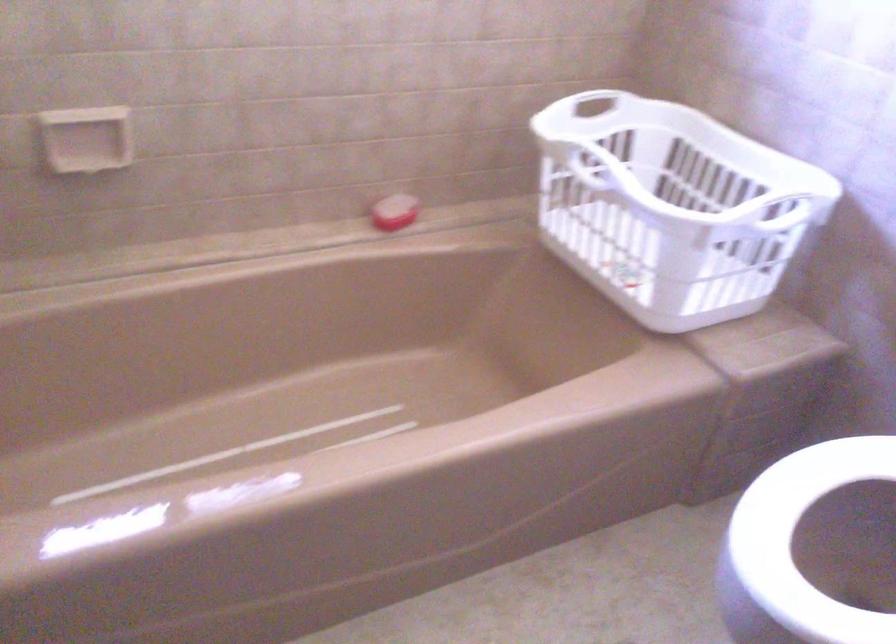
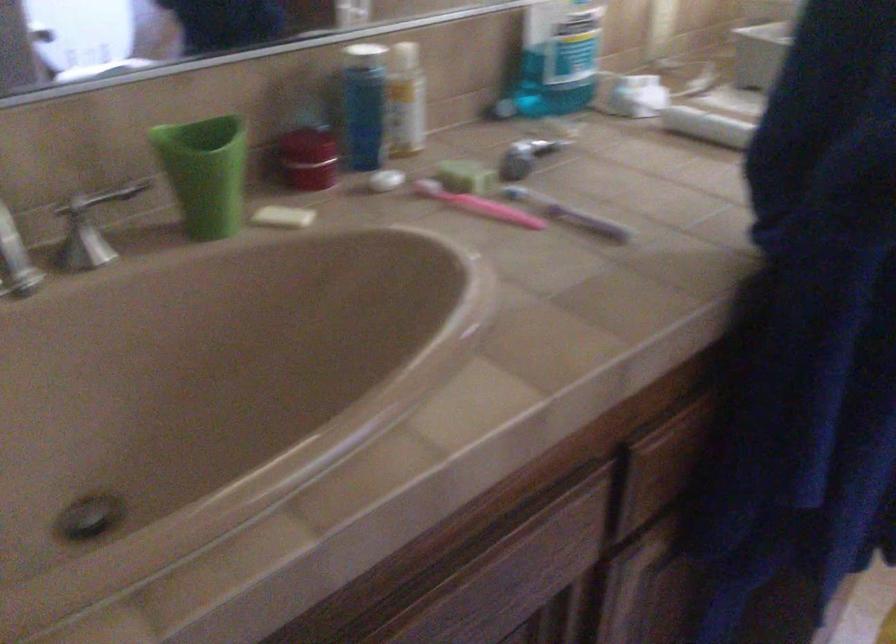
First-person continuous shooting, in which direction is the camera rotating?

The camera rotated toward left-down.